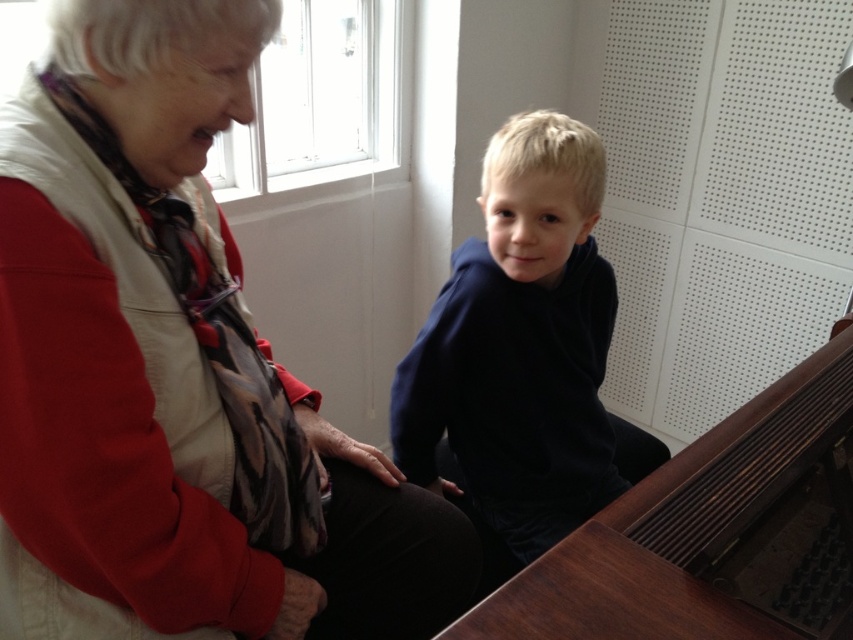
You are a photographer setting up for a family photo. You need to position a tripod in front of the brown wooden harpsichord at lower right without blocking the dark blue hoodie at center. Where should you place the tripod?

Place the tripod in front of the brown wooden harpsichord at lower right but behind the dark blue hoodie at center so that the hoodie is between the tripod and the harpsichord, ensuring it doesn not block the view of the hoodie.

You are a delivery person who needs to place a 14 inch wide package between the dark blue hoodie at center and the brown wooden harpsichord at lower right. Can the package fit in the space between them?

The distance between the dark blue hoodie at center and the brown wooden harpsichord at lower right is 15.15 inches, so the 14 inch wide package can fit in the space between them since it is narrower than the available distance.